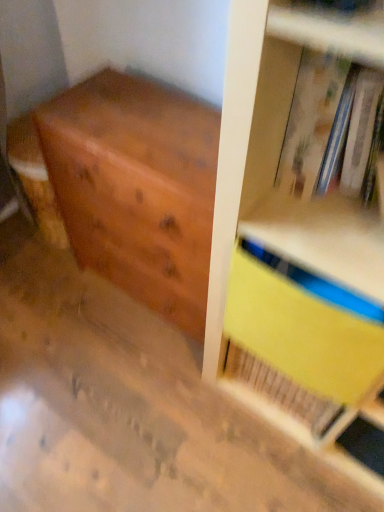
Question: Is hardcover book at upper right completely or partially outside of wooden chest of drawers at left?

Choices:
 (A) yes
 (B) no

Answer: (A)

Question: Is hardcover book at upper right bigger than wooden chest of drawers at left?

Choices:
 (A) yes
 (B) no

Answer: (B)

Question: Can wooden chest of drawers at left be found inside hardcover book at upper right?

Choices:
 (A) no
 (B) yes

Answer: (A)

Question: From a real-world perspective, is hardcover book at upper right on wooden chest of drawers at left?

Choices:
 (A) no
 (B) yes

Answer: (B)

Question: Can you confirm if hardcover book at upper right is thinner than wooden chest of drawers at left?

Choices:
 (A) no
 (B) yes

Answer: (B)

Question: In the image, is wooden chest of drawers at left positioned in front of or behind yellow matte paper at upper right?

Choices:
 (A) front
 (B) behind

Answer: (B)

Question: Is wooden chest of drawers at left spatially inside yellow matte paper at upper right, or outside of it?

Choices:
 (A) outside
 (B) inside

Answer: (A)

Question: In terms of width, does wooden chest of drawers at left look wider or thinner when compared to yellow matte paper at upper right?

Choices:
 (A) wide
 (B) thin

Answer: (A)

Question: Based on their sizes in the image, would you say wooden chest of drawers at left is bigger or smaller than yellow matte paper at upper right?

Choices:
 (A) big
 (B) small

Answer: (A)

Question: In terms of width, does yellow matte paper at upper right look wider or thinner when compared to wooden chest of drawers at left?

Choices:
 (A) wide
 (B) thin

Answer: (B)

Question: Visually, is yellow matte paper at upper right positioned to the left or to the right of wooden chest of drawers at left?

Choices:
 (A) left
 (B) right

Answer: (B)

Question: Is yellow matte paper at upper right taller or shorter than wooden chest of drawers at left?

Choices:
 (A) tall
 (B) short

Answer: (B)

Question: In the image, is yellow matte paper at upper right positioned in front of or behind wooden chest of drawers at left?

Choices:
 (A) behind
 (B) front

Answer: (B)

Question: Considering the positions of hardcover book at upper right and yellow matte paper at upper right in the image, is hardcover book at upper right taller or shorter than yellow matte paper at upper right?

Choices:
 (A) tall
 (B) short

Answer: (B)

Question: From a real-world perspective, is hardcover book at upper right positioned above or below yellow matte paper at upper right?

Choices:
 (A) below
 (B) above

Answer: (B)